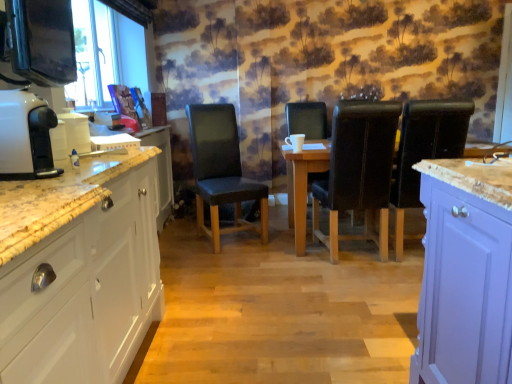
Question: Does white glossy cabinet at left appear on the left side of black leather chair at center, the 2th chair from the left?

Choices:
 (A) no
 (B) yes

Answer: (B)

Question: Is white glossy cabinet at left shorter than black leather chair at center, the 2th chair from the left?

Choices:
 (A) yes
 (B) no

Answer: (A)

Question: Could black leather chair at center, the 2th chair from the left, be considered to be inside white glossy cabinet at left?

Choices:
 (A) yes
 (B) no

Answer: (B)

Question: Can you confirm if white glossy cabinet at left is wider than black leather chair at center, the 2th chair from the left?

Choices:
 (A) no
 (B) yes

Answer: (A)

Question: Considering the relative positions of white glossy cabinet at left and black leather chair at center, which appears as the 3th chair when viewed from the right, in the image provided, is white glossy cabinet at left to the right of black leather chair at center, which appears as the 3th chair when viewed from the right, from the viewer's perspective?

Choices:
 (A) no
 (B) yes

Answer: (A)

Question: In the image, is wooden table at center on the left side or the right side of black leather chair at right, the first chair in the right-to-left sequence?

Choices:
 (A) left
 (B) right

Answer: (A)

Question: From a real-world perspective, relative to black leather chair at right, placed as the 4th chair when sorted from left to right, is wooden table at center vertically above or below?

Choices:
 (A) above
 (B) below

Answer: (B)

Question: Is wooden table at center situated inside black leather chair at right, placed as the 4th chair when sorted from left to right, or outside?

Choices:
 (A) outside
 (B) inside

Answer: (A)

Question: Considering the positions of point coord(316,155) and point coord(465,112), is point coord(316,155) closer or farther from the camera than point coord(465,112)?

Choices:
 (A) farther
 (B) closer

Answer: (A)

Question: Considering the relative positions of wooden table at center and white glossy coffee machine at left in the image provided, is wooden table at center to the left or to the right of white glossy coffee machine at left?

Choices:
 (A) left
 (B) right

Answer: (B)

Question: From the image's perspective, relative to white glossy coffee machine at left, is wooden table at center above or below?

Choices:
 (A) above
 (B) below

Answer: (B)

Question: From a real-world perspective, is wooden table at center above or below white glossy coffee machine at left?

Choices:
 (A) above
 (B) below

Answer: (B)

Question: Relative to white glossy coffee machine at left, is wooden table at center in front or behind?

Choices:
 (A) behind
 (B) front

Answer: (A)

Question: Considering the positions of leather at center, which is counted as the second chair, starting from the right, and black leather chair at center, the 2th chair from the left, in the image, is leather at center, which is counted as the second chair, starting from the right, bigger or smaller than black leather chair at center, the 2th chair from the left,?

Choices:
 (A) big
 (B) small

Answer: (A)

Question: In the image, is leather at center, which is counted as the second chair, starting from the right, on the left side or the right side of black leather chair at center, which appears as the 3th chair when viewed from the right?

Choices:
 (A) left
 (B) right

Answer: (B)